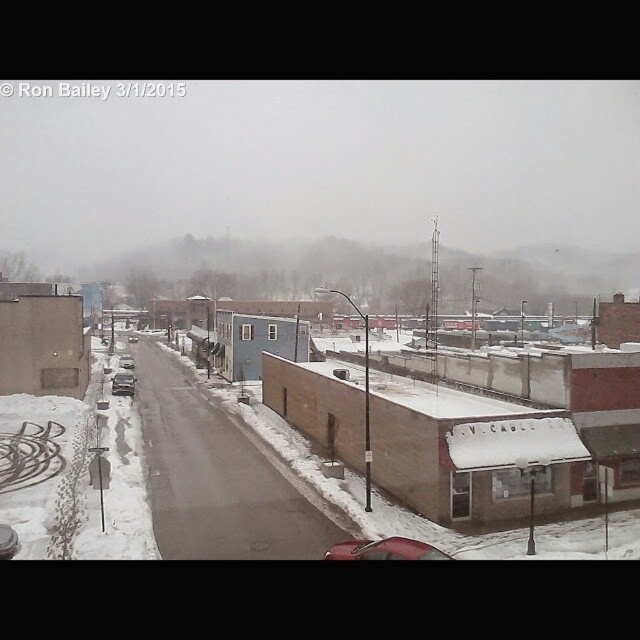
Is brown matte building at center in front of metallic silver sedan at center?

Yes, it is in front of metallic silver sedan at center.

Which is behind, point (497, 429) or point (122, 365)?

The point (122, 365) is more distant.

Find the location of a particular element. Image resolution: width=640 pixels, height=640 pixels. brown matte building at center is located at coordinates (438, 460).

Is shiny red car at center below metallic silver sedan at center-left?

Correct, shiny red car at center is located below metallic silver sedan at center-left.

Between shiny red car at center and metallic silver sedan at center-left, which one appears on the right side from the viewer's perspective?

Positioned to the right is shiny red car at center.

Between point (438, 548) and point (132, 381), which one is positioned in front?

Positioned in front is point (438, 548).

Identify the location of shiny red car at center. (385, 548).

Does brown matte building at center lie in front of metallic silver sedan at center-left?

Yes, it is.

Where is `brown matte building at center`? brown matte building at center is located at coordinates (438, 460).